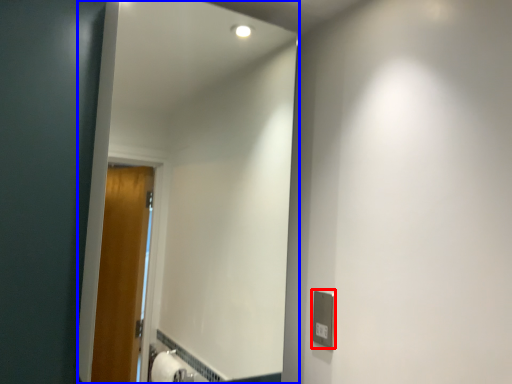
Question: Which of the following is the farthest to the observer, electric outlet (highlighted by a red box) or mirror (highlighted by a blue box)?

Choices:
 (A) electric outlet
 (B) mirror

Answer: (A)